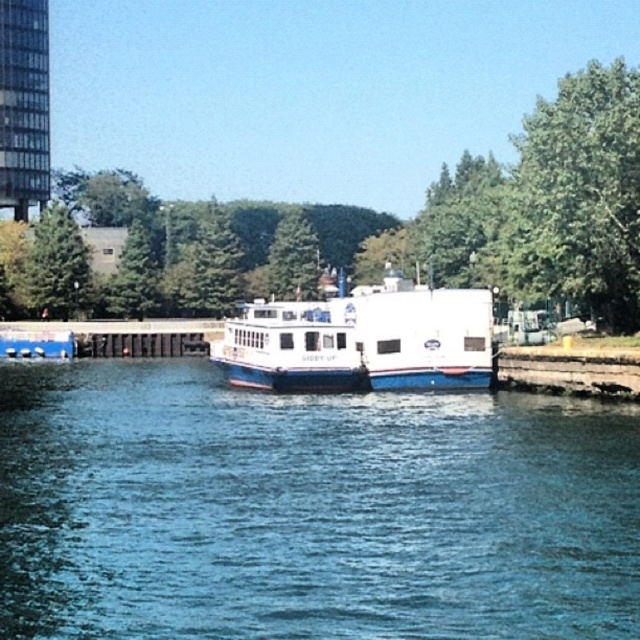
You are a photographer planning to capture the waterfront scene. You want to ensure both the blue glossy water at center and the white matte boat at center are clearly visible in your shot. Which object will appear larger in the photograph?

The white matte boat at center will appear larger in the photograph because it occupies more space than the blue glossy water at center.